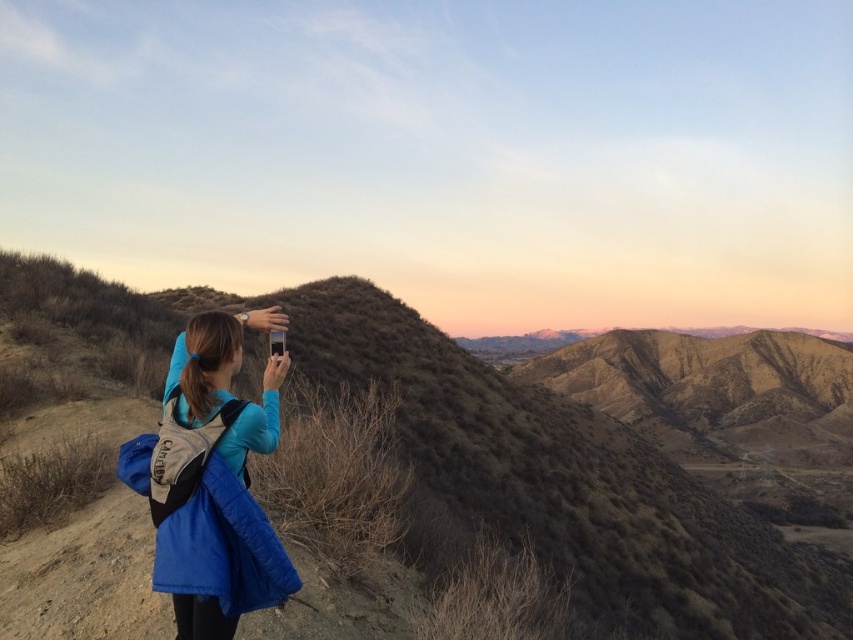
Question: Observing the image, what is the correct spatial positioning of brown textured hillside at center in reference to blue synthetic jacket at center?

Choices:
 (A) right
 (B) left

Answer: (A)

Question: Which point is closer to the camera taking this photo?

Choices:
 (A) (160, 449)
 (B) (753, 611)

Answer: (A)

Question: Is brown textured hillside at center positioned in front of blue synthetic jacket at center?

Choices:
 (A) no
 (B) yes

Answer: (A)

Question: Is brown textured hillside at center closer to the viewer compared to blue synthetic jacket at center?

Choices:
 (A) yes
 (B) no

Answer: (B)

Question: Which point is farther to the camera?

Choices:
 (A) (705, 500)
 (B) (277, 380)

Answer: (A)